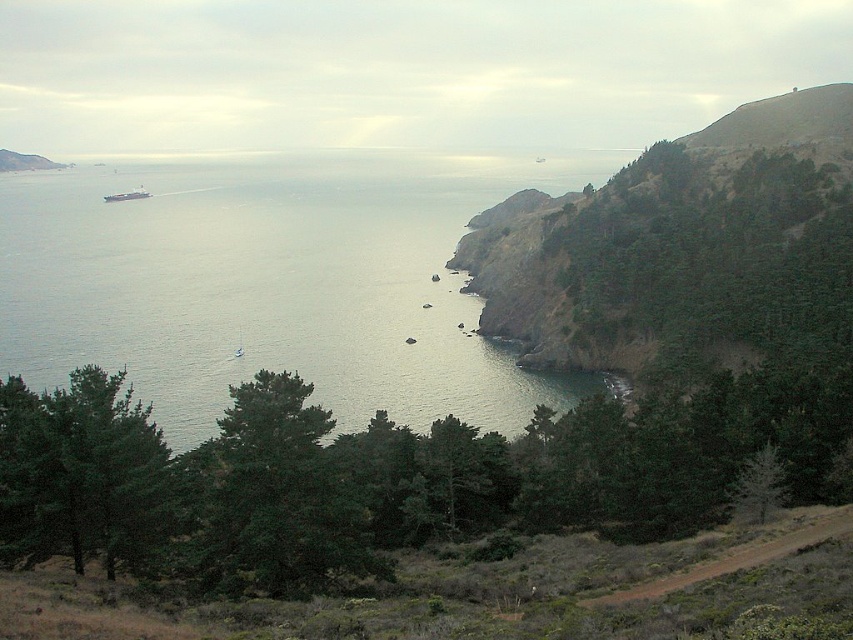
Question: Which of the following is the farthest from the observer?

Choices:
 (A) (109, 196)
 (B) (384, 248)
 (C) (16, 532)

Answer: (A)

Question: Among these points, which one is nearest to the camera?

Choices:
 (A) (152, 547)
 (B) (380, 214)
 (C) (350, 538)

Answer: (A)

Question: Does green matte tree at center have a greater width compared to green matte tree at lower left?

Choices:
 (A) yes
 (B) no

Answer: (A)

Question: Considering the real-world distances, which object is farthest from the green matte tree at lower left?

Choices:
 (A) green leafy trees at lower center
 (B) clear water at center

Answer: (B)

Question: Is green matte tree at lower left to the left of metallic gray ship at left from the viewer's perspective?

Choices:
 (A) no
 (B) yes

Answer: (A)

Question: Can you confirm if brown dirt path at lower right is positioned to the left of metallic gray ship at left?

Choices:
 (A) no
 (B) yes

Answer: (A)